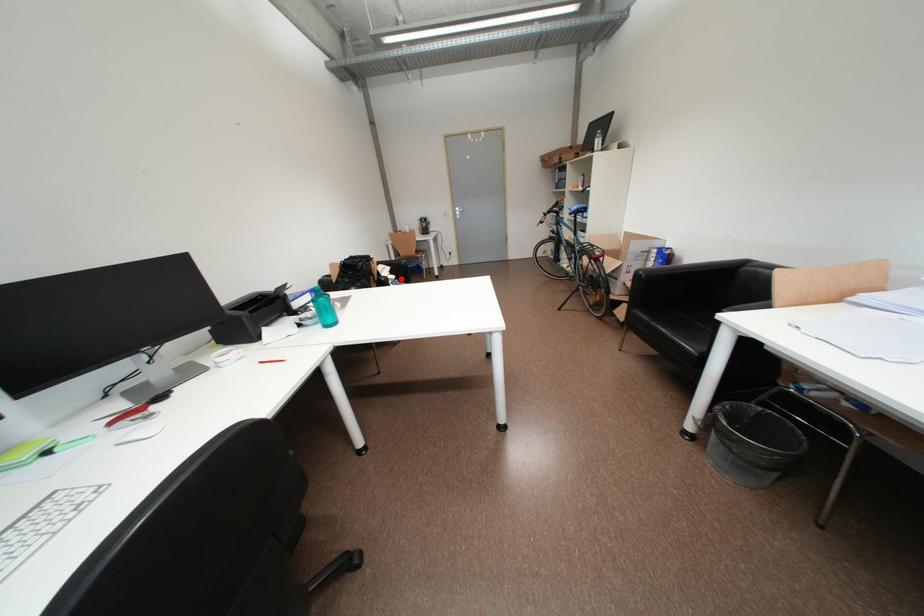
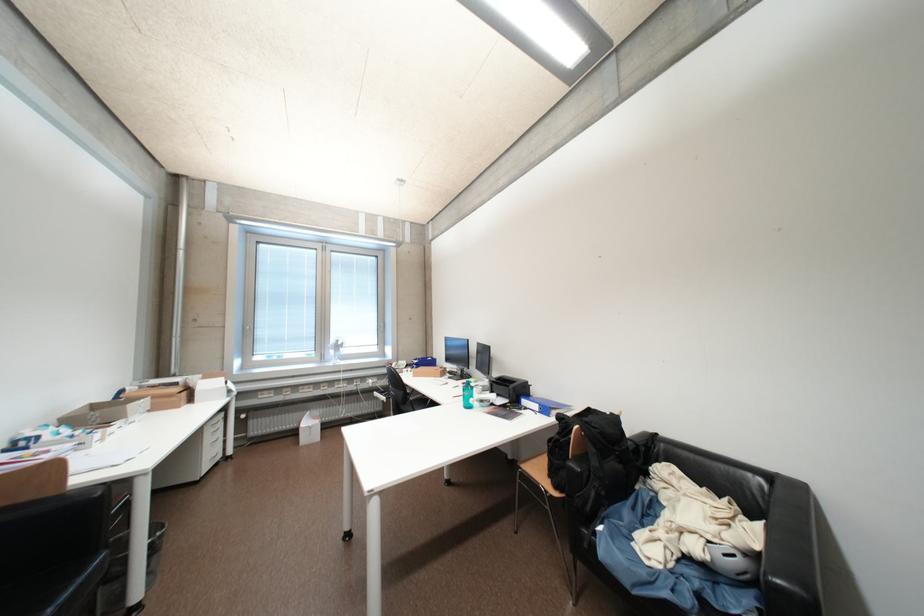
Question: I am providing you with two images of the same scene from different viewpoints. Given a red point in image1, look at the same physical point in image2. Is it:

Choices:
 (A) Closer to the viewpoint
 (B) Farther from the viewpoint

Answer: (B)